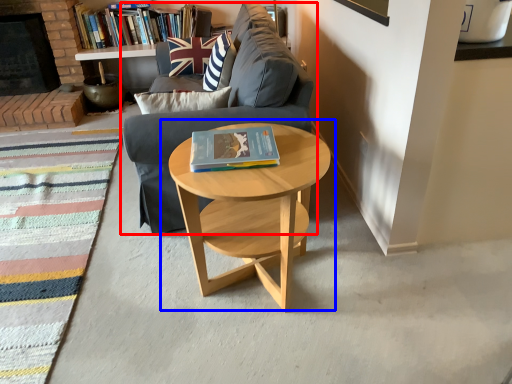
Question: Which point is closer to the camera, studio couch (highlighted by a red box) or coffee table (highlighted by a blue box)?

Choices:
 (A) studio couch
 (B) coffee table

Answer: (B)